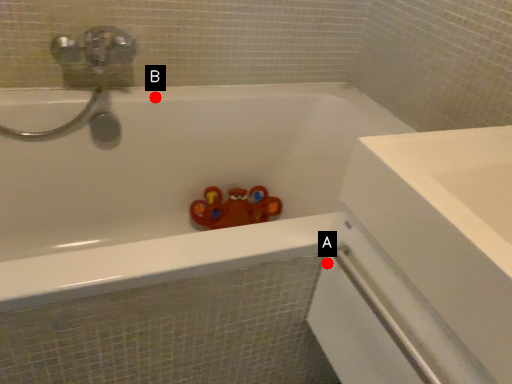
Question: Two points are circled on the image, labeled by A and B beside each circle. Among these points, which one is nearest to the camera?

Choices:
 (A) A is closer
 (B) B is closer

Answer: (A)